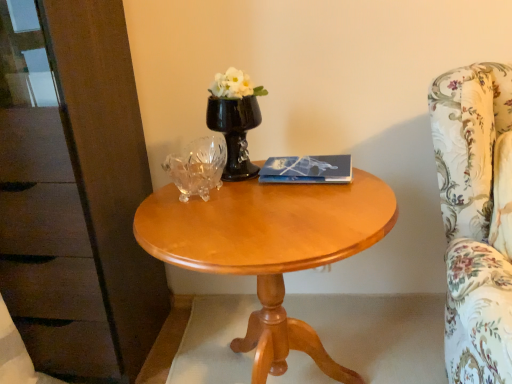
This screenshot has width=512, height=384. Find the location of `free point to the left of blue glossy book at center`. free point to the left of blue glossy book at center is located at coordinates tap(242, 192).